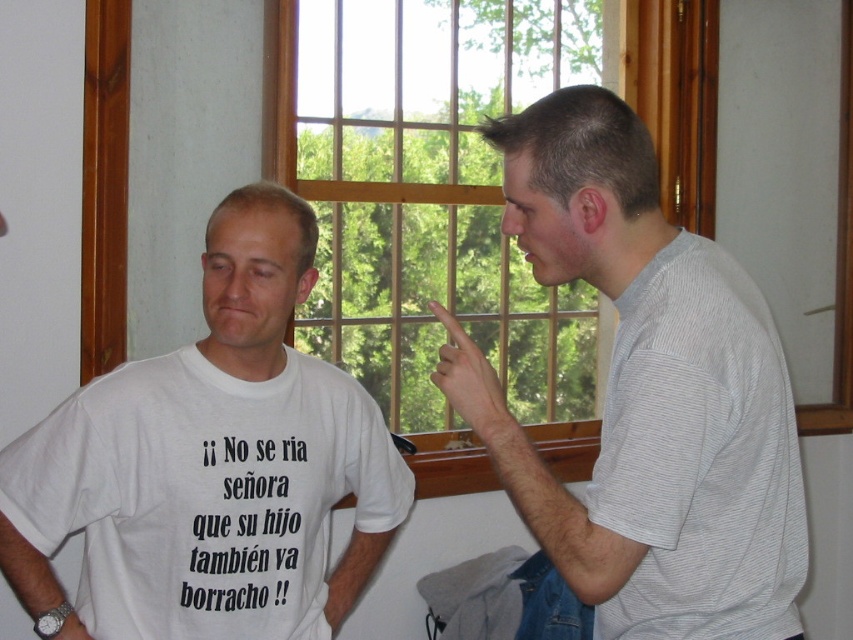
Who is lower down, white cotton t-shirt at left or gray striped t-shirt at right?

gray striped t-shirt at right

Can you confirm if white cotton t-shirt at left is positioned to the right of gray striped t-shirt at right?

No, white cotton t-shirt at left is not to the right of gray striped t-shirt at right.

Between point (258, 604) and point (717, 520), which one is positioned behind?

Positioned behind is point (258, 604).

Where is `white cotton t-shirt at left`? white cotton t-shirt at left is located at coordinates (210, 465).

Does gray striped shirt at right have a greater height compared to white cotton t-shirt at left?

Incorrect, gray striped shirt at right's height is not larger of white cotton t-shirt at left's.

Measure the distance between point [791,474] and camera.

Point [791,474] is 4.55 feet away from camera.

Where is `gray striped shirt at right`? This screenshot has height=640, width=853. gray striped shirt at right is located at coordinates (646, 394).

Who is higher up, wooden frame at upper center or gray striped t-shirt at right?

wooden frame at upper center

Which is below, wooden frame at upper center or gray striped t-shirt at right?

gray striped t-shirt at right is below.

Is point (335, 240) less distant than point (689, 412)?

No, (335, 240) is further to viewer.

You are a GUI agent. You are given a task and a screenshot of the screen. Output one action in this format:
    pyautogui.click(x=<x>, y=<y>)
    Task: Click on the wooden frame at upper center
    The image size is (853, 640).
    Given the screenshot: What is the action you would take?
    pyautogui.click(x=427, y=193)